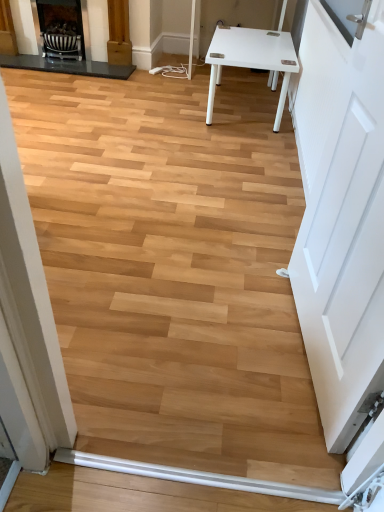
Locate an element on the screen. free space on the front side of matte black fireplace at upper left, the 2th fireplace positioned from the right is located at coordinates (67, 86).